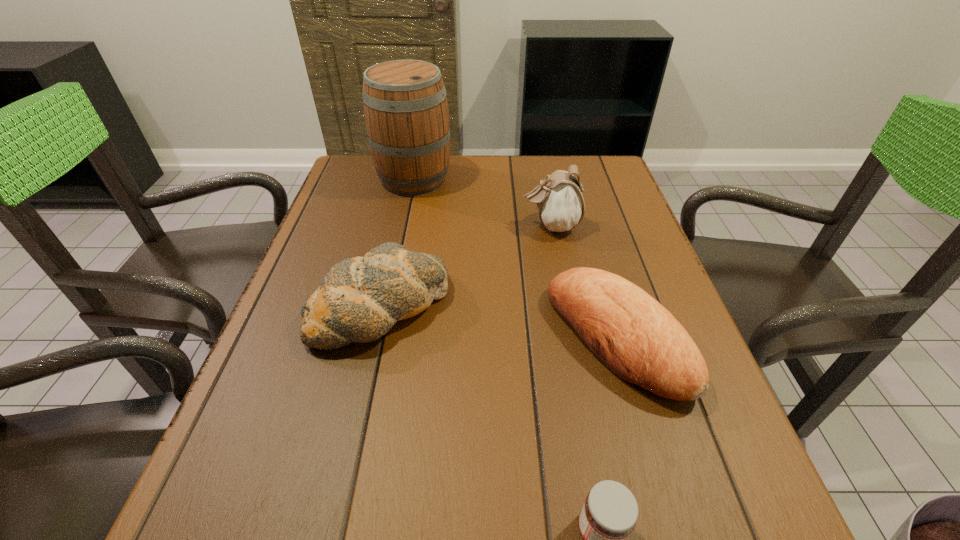
The width and height of the screenshot is (960, 540). Find the location of `free space at the left edge of the desktop`. free space at the left edge of the desktop is located at coordinates (216, 489).

Locate an element on the screen. free space at the far left corner is located at coordinates (366, 180).

The image size is (960, 540). What are the coordinates of `vacant space at the near right corner of the desktop` in the screenshot? It's located at (717, 519).

At what (x,y) coordinates should I click in order to perform the action: click on free point between the third shortest object and the shorter bread. Please return your answer as a coordinate pair (x, y). The width and height of the screenshot is (960, 540). Looking at the image, I should click on click(x=498, y=322).

Find the location of a particular element. The image size is (960, 540). free space that is in between the taller bread and the fourth nearest object is located at coordinates (466, 266).

The height and width of the screenshot is (540, 960). What are the coordinates of `free space between the shorter bread and the farthest object` in the screenshot? It's located at (516, 258).

I want to click on free space between the farthest object and the third tallest object, so click(397, 242).

I want to click on unoccupied position between the second farthest object and the farthest object, so click(x=483, y=202).

Find the location of a particular element. The height and width of the screenshot is (540, 960). object that is the second closest to the left bread is located at coordinates (635, 337).

Select which object appears as the closest to the jam. Please provide its 2D coordinates. Your answer should be formatted as a tuple, i.e. [(x, y)], where the tuple contains the x and y coordinates of a point satisfying the conditions above.

[(635, 337)]